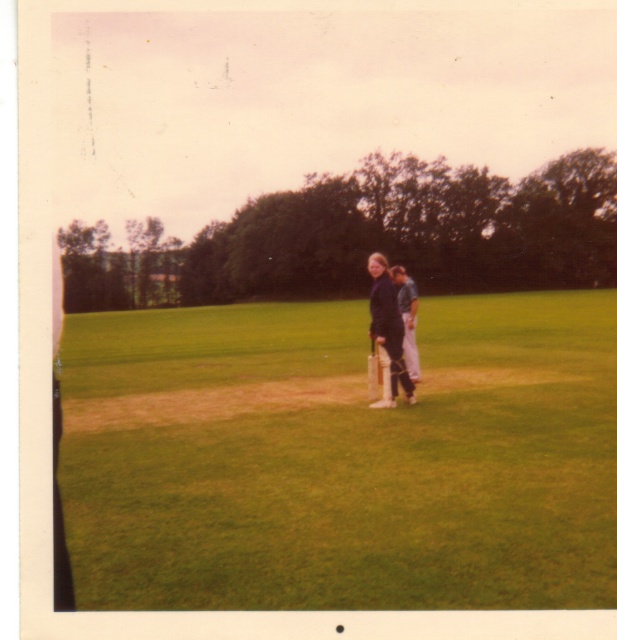
You are a photographer trying to capture a photo of the dark blue fabric jacket at center and the wooden baseball bat at center. If you want to ensure both are fully visible in the frame, which object should you focus on first to avoid cropping?

The dark blue fabric jacket at center is much taller than the wooden baseball bat at center, so you should focus on positioning the dark blue fabric jacket at center first to ensure it fits within the frame.

You are taking a photo of the two people holding cricket bats on the grassy field. You want to focus on the point closer to the camera between the two points marked as point 1 at (405, 353) and point 2 at (381, 380). Which point should you focus on?

You should focus on point 1 at (405, 353) because it is further to the camera than point 2 at (381, 380).